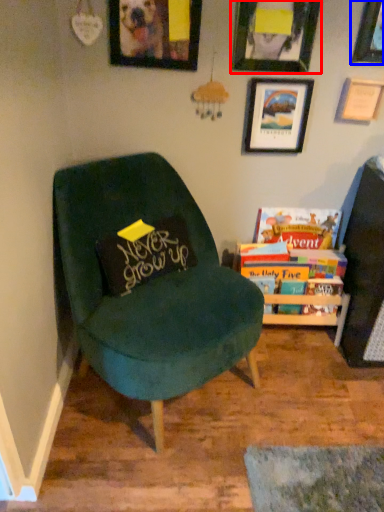
Question: Among these objects, which one is nearest to the camera, picture frame (highlighted by a red box) or picture frame (highlighted by a blue box)?

Choices:
 (A) picture frame
 (B) picture frame

Answer: (A)